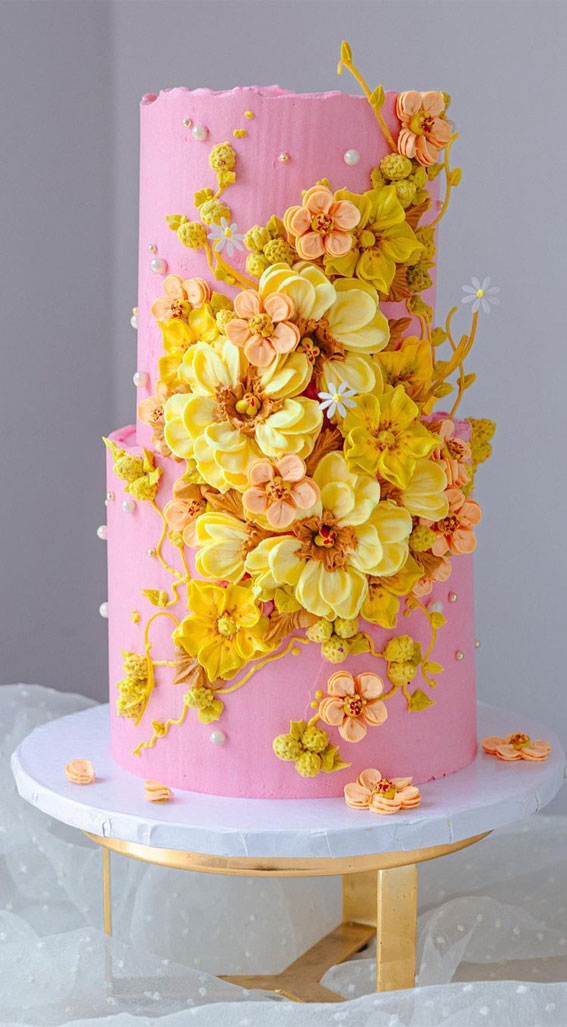
Locate an element on the screen. The height and width of the screenshot is (1027, 567). grey wall in background is located at coordinates (537, 650), (527, 546), (516, 386), (524, 266), (61, 581), (29, 366), (81, 221).